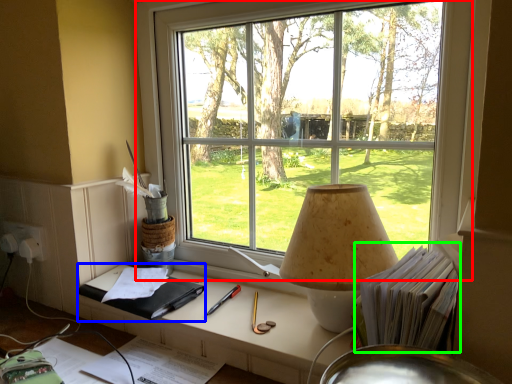
Question: Based on their relative distances, which object is nearer to window (highlighted by a red box)? Choose from notebook (highlighted by a blue box) and book (highlighted by a green box).

Choices:
 (A) notebook
 (B) book

Answer: (B)